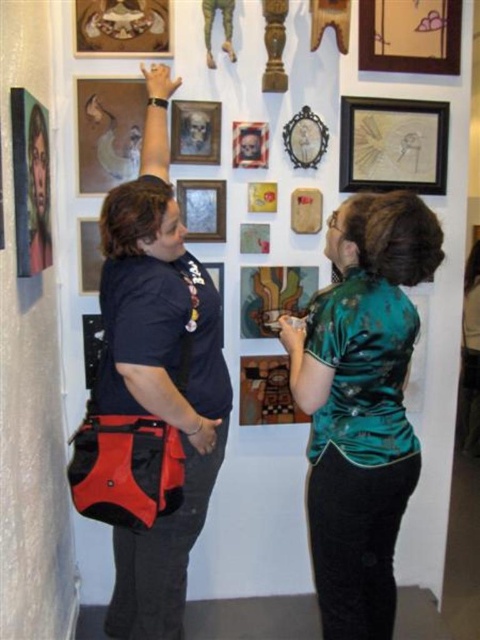
Question: Which object is the closest to the wooden ornate frame at upper center?

Choices:
 (A) matte black picture frame at upper center
 (B) matte brown painting at upper left

Answer: (A)

Question: Which object is closer to the camera taking this photo?

Choices:
 (A) matte black skull at upper center
 (B) wooden skull at upper center
 (C) matte wooden picture frame at upper left
 (D) matte black picture frame at upper left

Answer: (C)

Question: Considering the relative positions of matte glass painting at center and wooden picture frame at center in the image provided, where is matte glass painting at center located with respect to wooden picture frame at center?

Choices:
 (A) right
 (B) left

Answer: (A)

Question: Is the position of matte wooden picture frame at upper left less distant than that of wooden skull at upper center?

Choices:
 (A) yes
 (B) no

Answer: (A)

Question: Does matte brown painting at upper left appear on the left side of wooden picture frame at upper center?

Choices:
 (A) yes
 (B) no

Answer: (A)

Question: Which point appears closest to the camera in this image?

Choices:
 (A) (101, 216)
 (B) (220, 264)
 (C) (330, 305)
 (D) (417, 20)

Answer: (C)